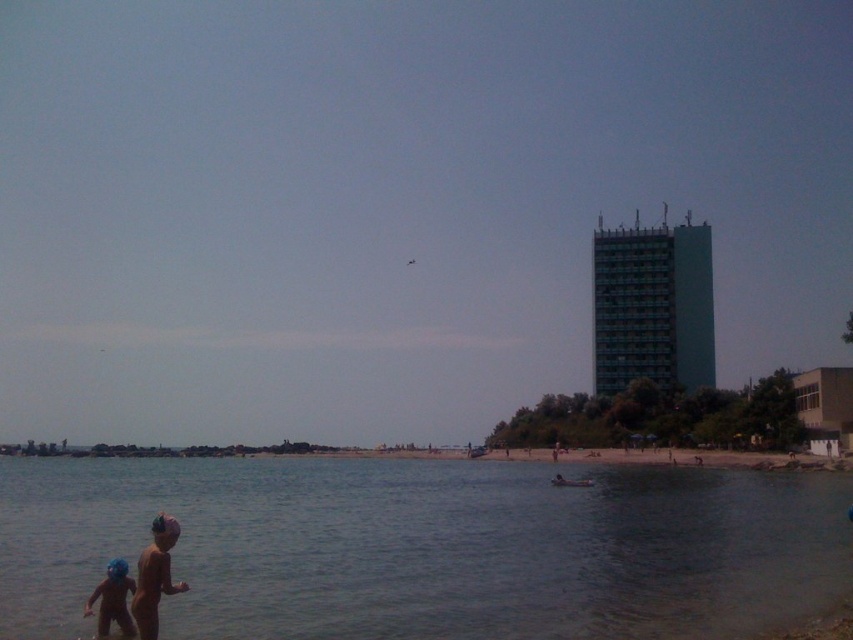
Who is taller, clear water at lower left or blue rubber helmet at lower left?

Standing taller between the two is clear water at lower left.

Is clear water at lower left below blue rubber helmet at lower left?

Correct, clear water at lower left is located below blue rubber helmet at lower left.

Between point (804, 547) and point (102, 632), which one is positioned in front?

Point (102, 632)

Locate an element on the screen. The height and width of the screenshot is (640, 853). clear water at lower left is located at coordinates point(425,547).